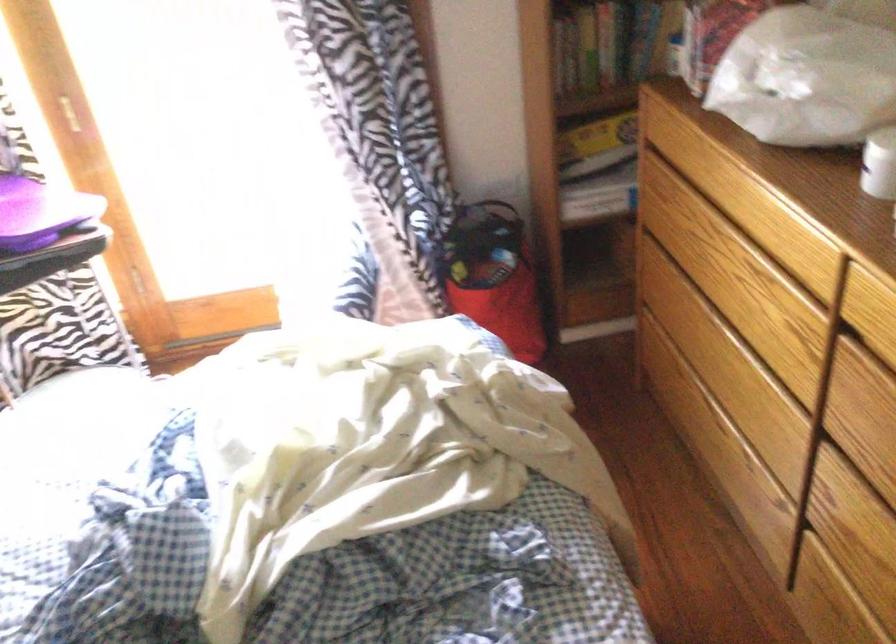
Find the location of `bag handle`. bag handle is located at coordinates (493, 200).